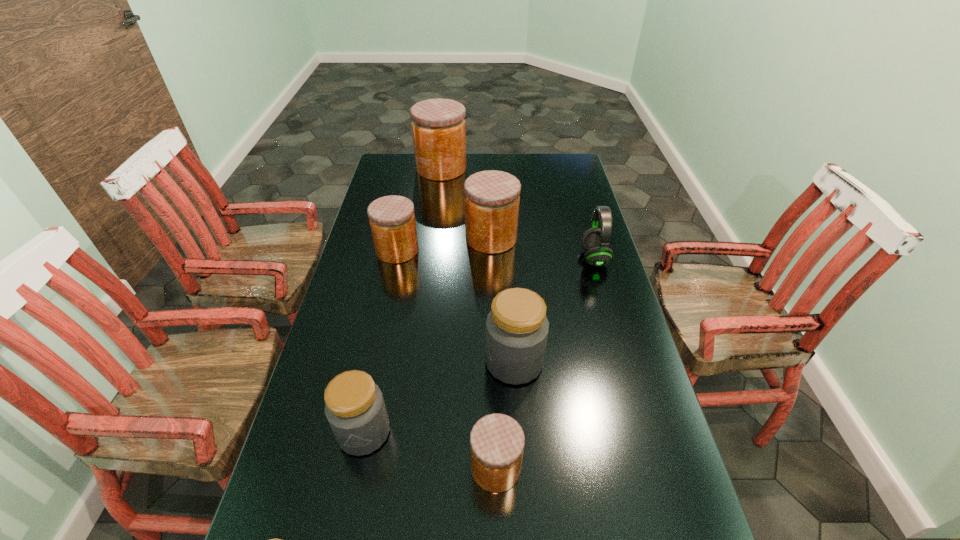
Identify the location of vacant area situated 0.380m on the left of the nearest orange jar. (300, 468).

Locate an element on the screen. This screenshot has height=540, width=960. object present at the far edge is located at coordinates (438, 126).

This screenshot has width=960, height=540. Find the location of `object located at the right edge`. object located at the right edge is located at coordinates (595, 241).

This screenshot has height=540, width=960. Identify the location of object that is positioned at the far left corner. (438, 126).

Image resolution: width=960 pixels, height=540 pixels. In the image, there is a desktop. In order to click on vacant space at the far edge in this screenshot , I will do `click(468, 161)`.

Identify the location of free region at the left edge of the desktop. (289, 506).

Locate an element on the screen. vacant space at the right edge is located at coordinates coord(618,381).

You are a GUI agent. You are given a task and a screenshot of the screen. Output one action in this format:
    pyautogui.click(x=<x>, y=<y>)
    Task: Click on the free spot at the far left corner of the desktop
    
    Given the screenshot: What is the action you would take?
    pyautogui.click(x=413, y=164)

You are a GUI agent. You are given a task and a screenshot of the screen. Output one action in this format:
    pyautogui.click(x=<x>, y=<y>)
    Task: Click on the vacant region at the far right corner of the desktop
    This screenshot has height=540, width=960.
    Given the screenshot: What is the action you would take?
    pyautogui.click(x=566, y=178)

Where is `free space between the second smallest orange jar and the headset`? Image resolution: width=960 pixels, height=540 pixels. free space between the second smallest orange jar and the headset is located at coordinates pyautogui.click(x=495, y=254).